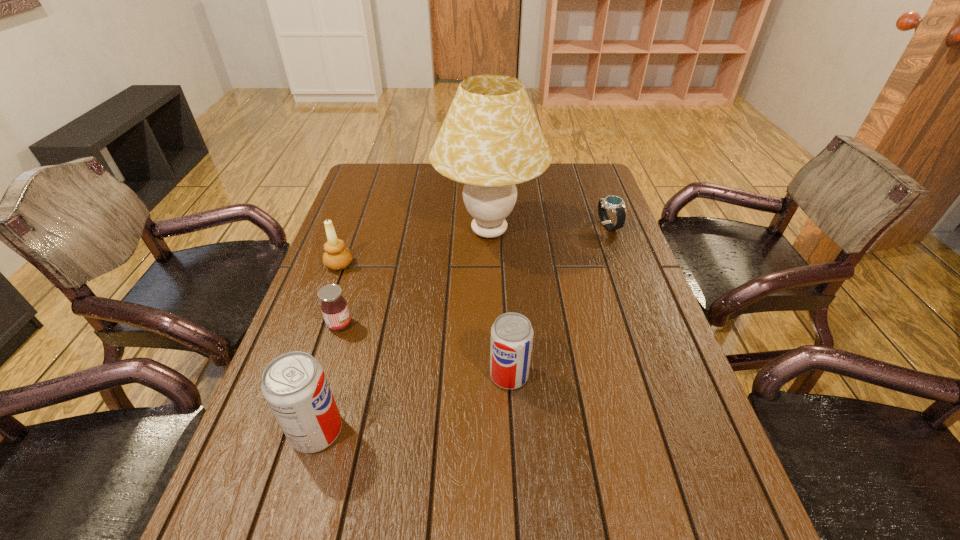
Please point out where to position a new soda on the right to maintain spacing. Please provide its 2D coordinates. Your answer should be formatted as a tuple, i.e. [(x, y)], where the tuple contains the x and y coordinates of a point satisfying the conditions above.

[(666, 329)]